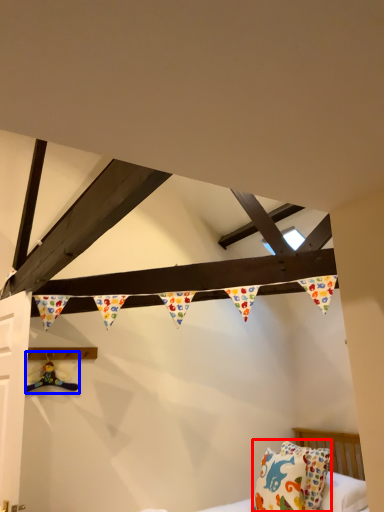
Question: Which point is further to the camera, pillow (highlighted by a red box) or toy (highlighted by a blue box)?

Choices:
 (A) pillow
 (B) toy

Answer: (B)